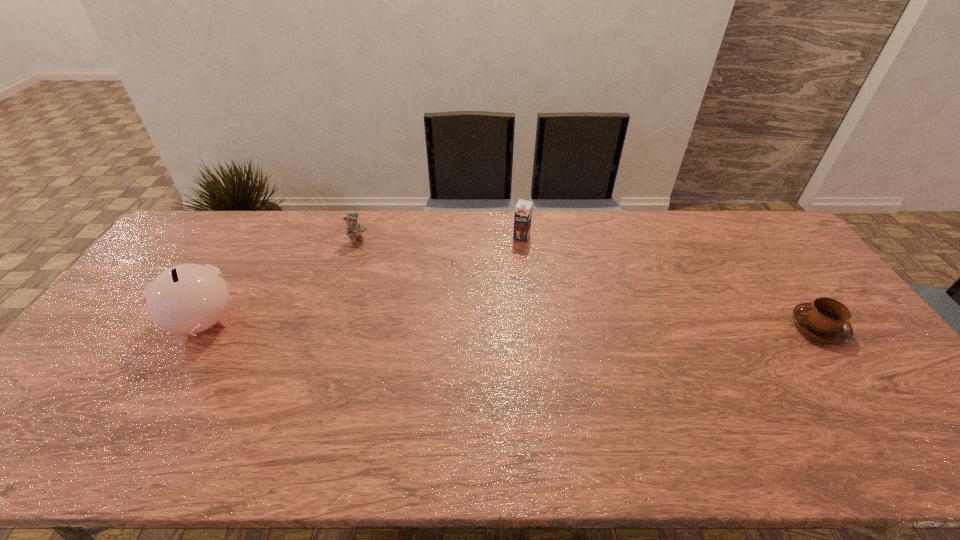
Where is `free space on the desktop that is between the leftmost object and the shortest object and is positioned on the front label of the chocolate milk`? free space on the desktop that is between the leftmost object and the shortest object and is positioned on the front label of the chocolate milk is located at coordinates (480, 325).

Where is `vacant space on the desktop that is between the leftmost object and the shortest object and is positioned on the front-facing side of the second object from left to right`? The width and height of the screenshot is (960, 540). vacant space on the desktop that is between the leftmost object and the shortest object and is positioned on the front-facing side of the second object from left to right is located at coordinates (473, 325).